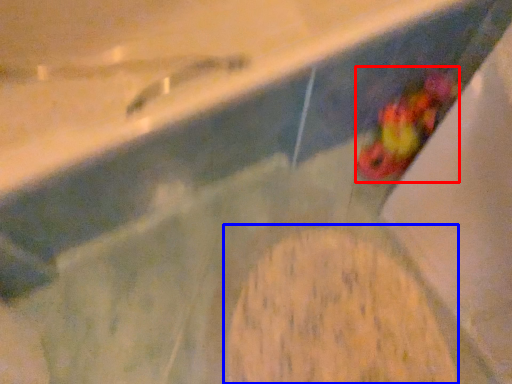
Question: Which of the following is the farthest to the observer, food (highlighted by a red box) or food (highlighted by a blue box)?

Choices:
 (A) food
 (B) food

Answer: (A)